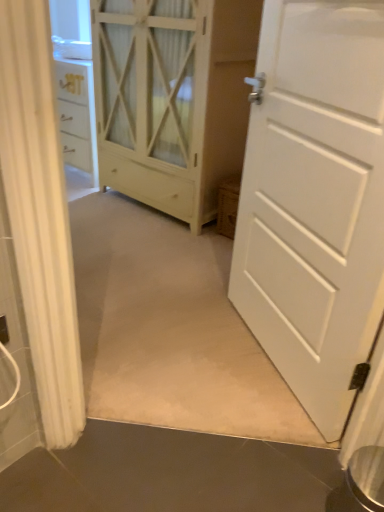
Question: Does white matte door at right have a greater width compared to white wood cupboard at center?

Choices:
 (A) yes
 (B) no

Answer: (B)

Question: Is white matte door at right beside white wood cupboard at center?

Choices:
 (A) no
 (B) yes

Answer: (A)

Question: From a real-world perspective, is white matte door at right physically above white wood cupboard at center?

Choices:
 (A) yes
 (B) no

Answer: (B)

Question: Would you consider white matte door at right to be distant from white wood cupboard at center?

Choices:
 (A) yes
 (B) no

Answer: (A)

Question: Is white matte door at right located outside white wood cupboard at center?

Choices:
 (A) yes
 (B) no

Answer: (A)

Question: Considering the relative positions of white matte door at right and white wood cupboard at center in the image provided, is white matte door at right to the left of white wood cupboard at center from the viewer's perspective?

Choices:
 (A) yes
 (B) no

Answer: (B)

Question: Is white wood cupboard at center thinner than white matte door at right?

Choices:
 (A) yes
 (B) no

Answer: (B)

Question: Is white wood cupboard at center further to the viewer compared to white matte door at right?

Choices:
 (A) yes
 (B) no

Answer: (A)

Question: Considering the relative sizes of white wood cupboard at center and white matte door at right in the image provided, is white wood cupboard at center taller than white matte door at right?

Choices:
 (A) no
 (B) yes

Answer: (B)

Question: Is white wood cupboard at center to the right of white matte door at right from the viewer's perspective?

Choices:
 (A) no
 (B) yes

Answer: (A)

Question: Does white wood cupboard at center turn towards white matte door at right?

Choices:
 (A) yes
 (B) no

Answer: (B)

Question: Is white wood cupboard at center oriented away from white matte door at right?

Choices:
 (A) no
 (B) yes

Answer: (A)

Question: In terms of width, does white wood cupboard at center look wider or thinner when compared to white matte door at right?

Choices:
 (A) thin
 (B) wide

Answer: (B)